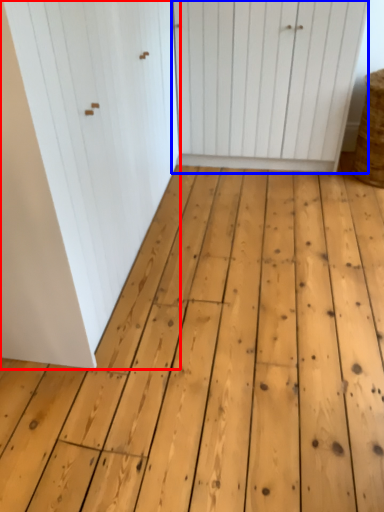
Question: Which object appears farthest to the camera in this image, door (highlighted by a red box) or door (highlighted by a blue box)?

Choices:
 (A) door
 (B) door

Answer: (B)